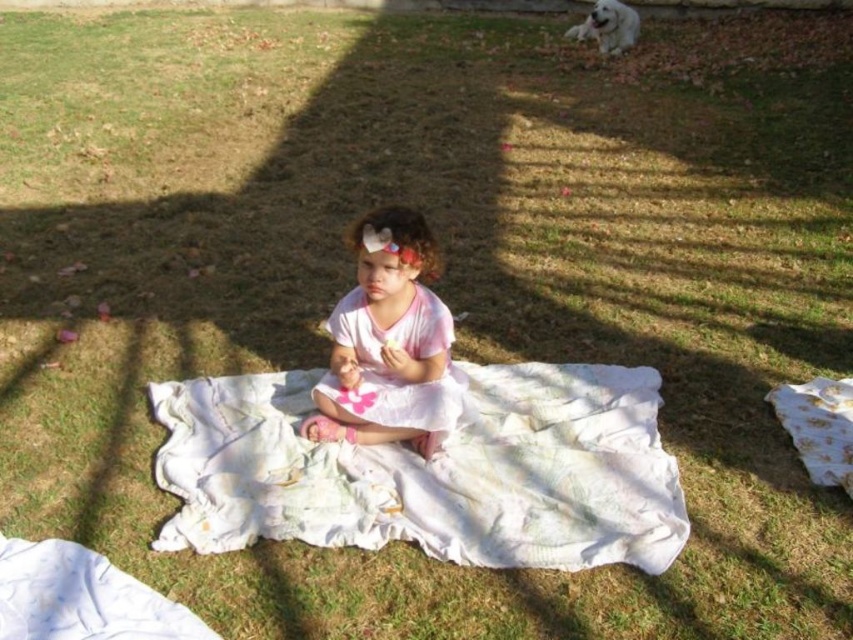
You are a photographer trying to capture the child in the scene. You want to position your camera so that the pink satin dress at center is directly in front of the white textured blanket at center. Based on their current positions, is this possible without moving either object?

The white textured blanket at center is to the right of the pink satin dress at center, so positioning the camera so that the pink satin dress at center is directly in front of the white textured blanket at center is possible by angling the camera to align them in the frame.

A child is sitting on a white textured blanket at center in a grassy area. If you were to draw a straight line from the child to the edge of the blanket, which direction would it point?

The direction of the line would depend on the position of the child relative to the blanket. Since the child is sitting on the white textured blanket at center, the line would point towards the edge of the blanket in the direction away from the center. However, without specific coordinates or additional spatial information about the child and the blanket, it is not possible to determine the exact direction.

You are a parent trying to lay out a picnic for your child. You have a basket containing the pink satin dress at center and the white textured blanket at center. If you want to ensure the blanket covers the dress completely, which object should you place first on the ground?

You should place the white textured blanket at center first because it might be wider than the pink satin dress at center, allowing it to cover the dress completely.